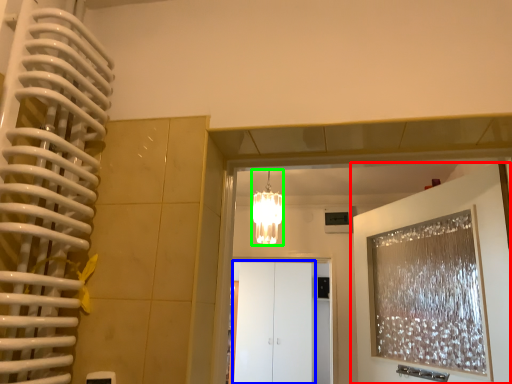
Question: Which object is positioned farthest from door (highlighted by a red box)? Select from glass door (highlighted by a blue box) and lamp (highlighted by a green box).

Choices:
 (A) glass door
 (B) lamp

Answer: (A)